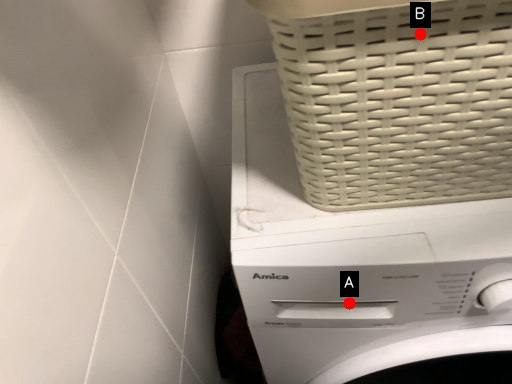
Question: Two points are circled on the image, labeled by A and B beside each circle. Which point appears closest to the camera in this image?

Choices:
 (A) A is closer
 (B) B is closer

Answer: (B)